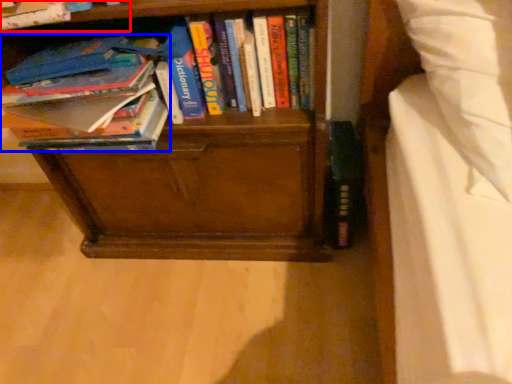
Question: Among these objects, which one is nearest to the camera, book (highlighted by a red box) or book (highlighted by a blue box)?

Choices:
 (A) book
 (B) book

Answer: (A)